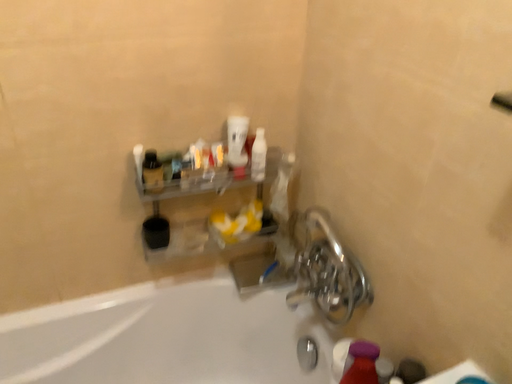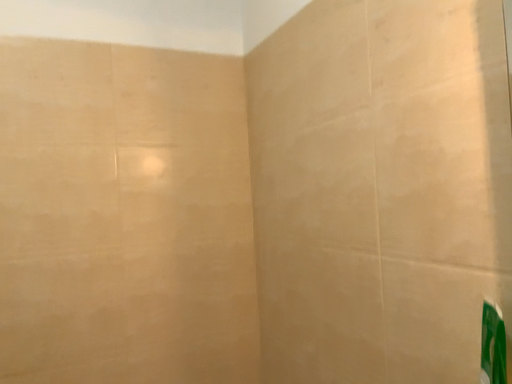
Question: Which way did the camera rotate in the video?

Choices:
 (A) rotated downward
 (B) rotated upward

Answer: (B)